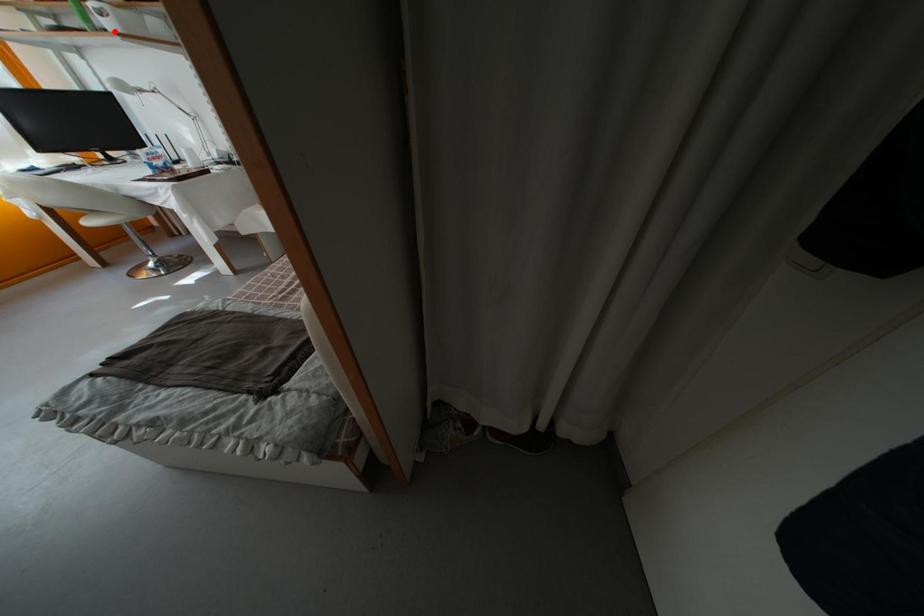
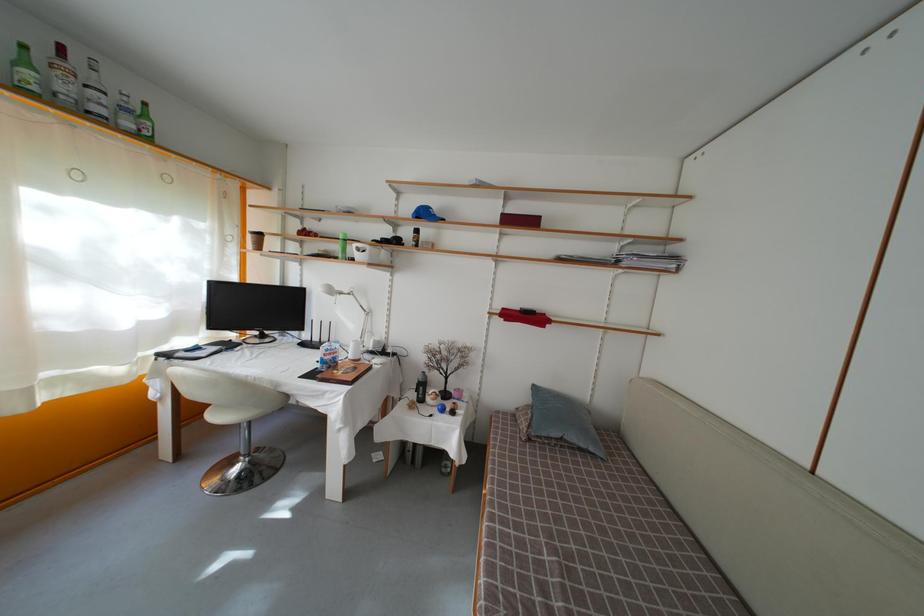
Where in the second image is the point corresponding to the highlighted location from the first image?

(363, 262)